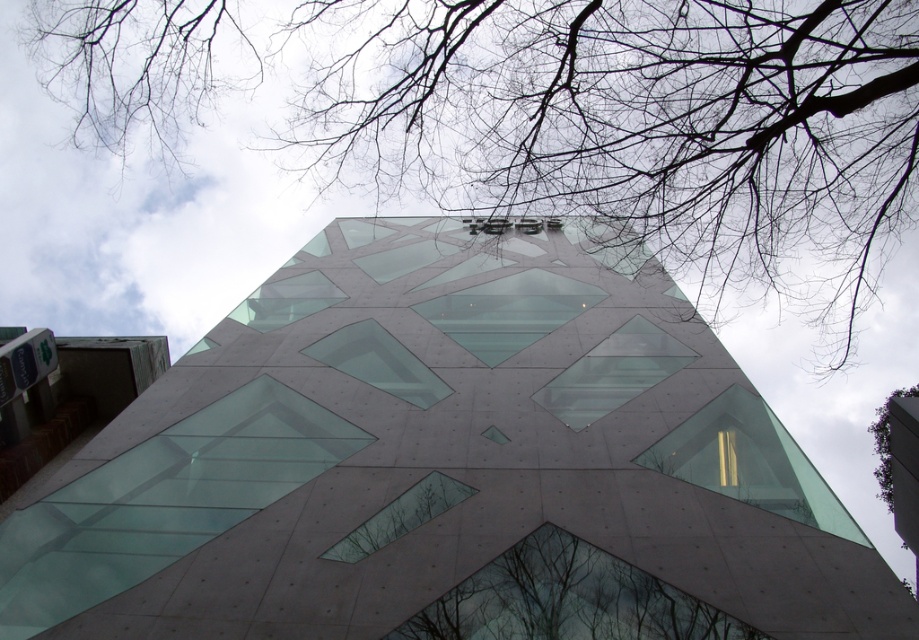
You are a photographer standing at the base of the building. You want to capture a photo where the bare branches at upper center appear larger in the frame. What should you do?

To make the bare branches at upper center appear larger in the frame, you should move closer to them since they are currently 6.81 meters away from the camera. Reducing the distance will magnify their size in the photo.

You are standing in front of the modern building and notice two trees in the scene. Which tree, the bare branches at upper center or the green leafy tree at upper right, is taller?

The green leafy tree at upper right is taller than the bare branches at upper center.

Looking at this image, you are an architect analyzing the building in the scene. You notice the bare branches at upper center and the dark brown textured tree at bottom center. Which of these two objects occupies a larger area in the image?

The bare branches at upper center is bigger than the dark brown textured tree at bottom center, so the bare branches at upper center occupies a larger area in the image.